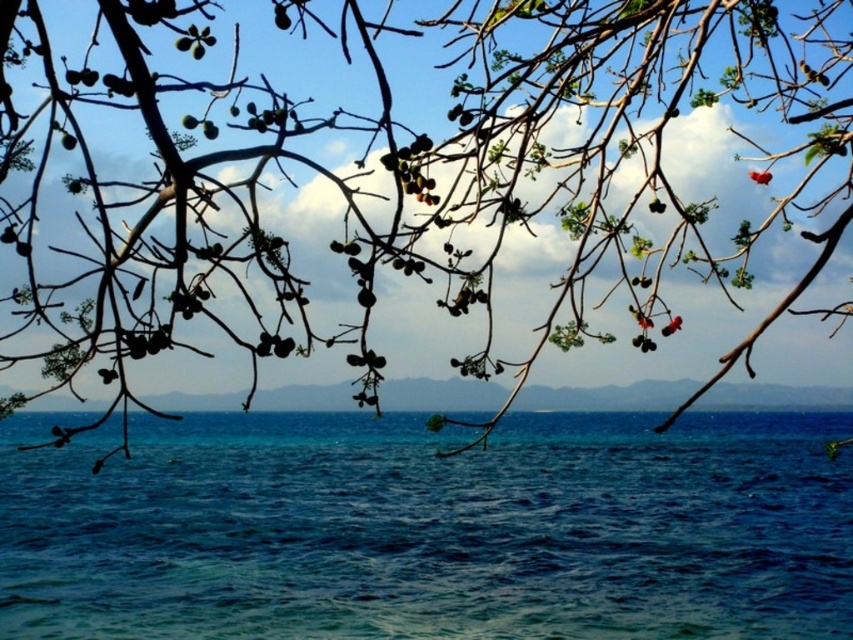
Between point (650, 554) and point (846, 122), which one is positioned in front?

Point (846, 122) is in front.

Can you confirm if blue liquid water at lower center is positioned below green matte leaves at upper center?

Indeed, blue liquid water at lower center is positioned under green matte leaves at upper center.

The height and width of the screenshot is (640, 853). What do you see at coordinates (428, 529) in the screenshot?
I see `blue liquid water at lower center` at bounding box center [428, 529].

This screenshot has height=640, width=853. Identify the location of blue liquid water at lower center. (428, 529).

Between blue liquid water at lower center and blue matte horizon at center, which one is positioned higher?

blue matte horizon at center

Consider the image. Does blue liquid water at lower center have a lesser height compared to blue matte horizon at center?

In fact, blue liquid water at lower center may be taller than blue matte horizon at center.

What do you see at coordinates (428, 529) in the screenshot?
I see `blue liquid water at lower center` at bounding box center [428, 529].

What are the coordinates of `blue liquid water at lower center` in the screenshot? It's located at (428, 529).

Between green matte leaves at upper center and blue matte horizon at center, which one is positioned lower?

blue matte horizon at center is below.

Does green matte leaves at upper center have a lesser height compared to blue matte horizon at center?

No, green matte leaves at upper center is not shorter than blue matte horizon at center.

You are a GUI agent. You are given a task and a screenshot of the screen. Output one action in this format:
    pyautogui.click(x=<x>, y=<y>)
    Task: Click on the green matte leaves at upper center
    This screenshot has height=640, width=853.
    Given the screenshot: What is the action you would take?
    pyautogui.click(x=422, y=173)